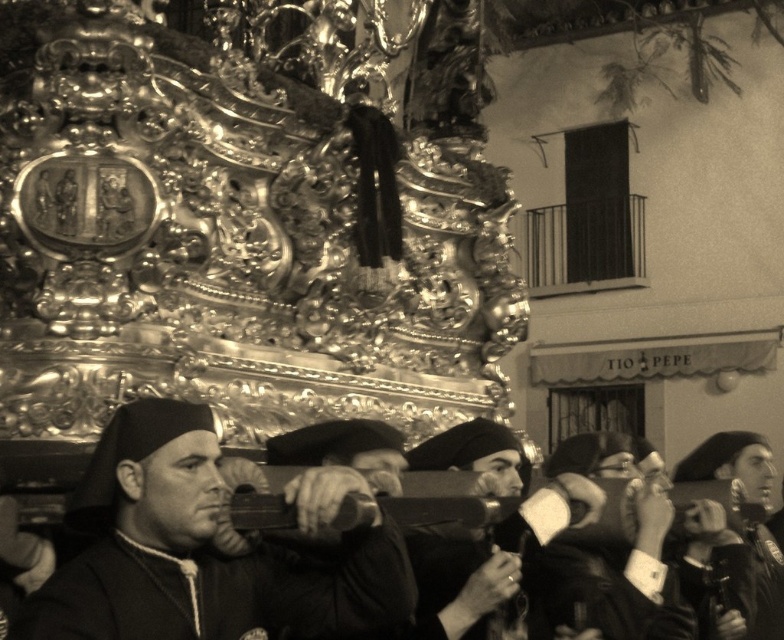
You are observing a religious procession and notice two items worn by the individuals carrying the float. The items are the smooth black robe at center and the smooth black hat at center. Which item is positioned higher on the person?

The smooth black robe at center is located above the smooth black hat at center, so the robe is positioned higher on the person.

In the scene shown: You are a photographer trying to capture the float in the center. You notice the leather jacket at center and the smooth black hat at center. Which one is wider?

The smooth black hat at center is wider than the leather jacket at center.